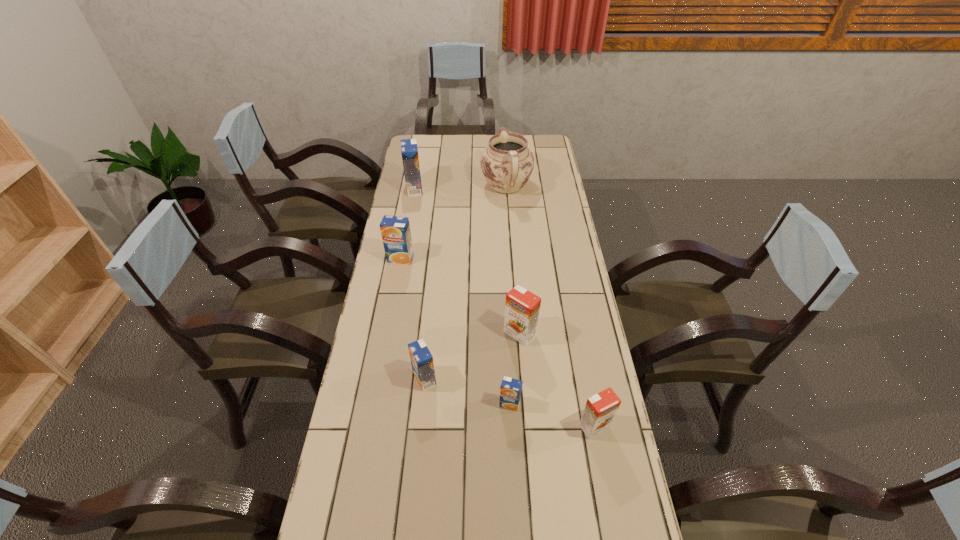
The width and height of the screenshot is (960, 540). In order to click on pitcher in this screenshot , I will do `click(507, 163)`.

Where is `the farthest orange_juice`? This screenshot has width=960, height=540. the farthest orange_juice is located at coordinates (409, 150).

Locate an element on the screen. the biggest blue orange_juice is located at coordinates (409, 150).

This screenshot has width=960, height=540. Identify the location of the second biggest blue orange_juice. (395, 231).

Locate an element on the screen. This screenshot has height=540, width=960. the third farthest object is located at coordinates (395, 231).

Where is `the fourth farthest object`? This screenshot has height=540, width=960. the fourth farthest object is located at coordinates (522, 307).

Where is `the third farthest orange_juice`? the third farthest orange_juice is located at coordinates (522, 307).

Where is `the fourth farthest orange_juice`? Image resolution: width=960 pixels, height=540 pixels. the fourth farthest orange_juice is located at coordinates (422, 363).

Image resolution: width=960 pixels, height=540 pixels. In order to click on the third farthest blue orange_juice in this screenshot , I will do `click(422, 363)`.

Locate an element on the screen. Image resolution: width=960 pixels, height=540 pixels. the nearest object is located at coordinates coord(599,412).